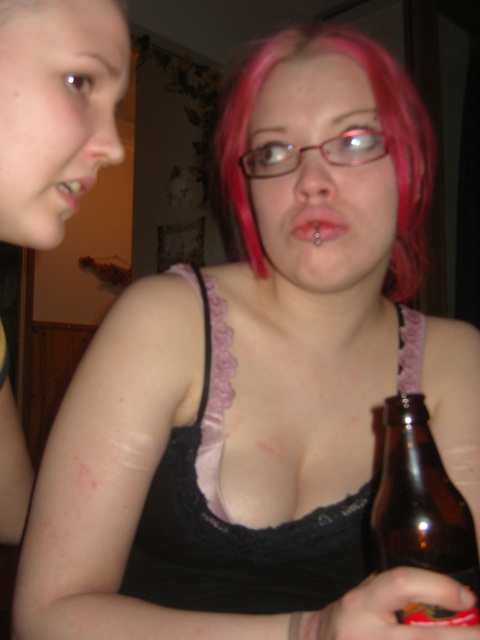
Question: Estimate the real-world distances between objects in this image. Which object is farther from the pink hair at center?

Choices:
 (A) brown glass bottle at lower right
 (B) matte pink lips at center
 (C) matte flesh-colored lips at center

Answer: (C)

Question: Which object is positioned farthest from the matte pink lips at center?

Choices:
 (A) pink hair at center
 (B) brown glass bottle at lower right
 (C) matte flesh-colored lips at center

Answer: (A)

Question: Does pink hair at center have a larger size compared to matte pink lips at center?

Choices:
 (A) no
 (B) yes

Answer: (B)

Question: Is pink hair at center thinner than matte pink lips at center?

Choices:
 (A) no
 (B) yes

Answer: (A)

Question: Does pink hair at center lie in front of matte flesh-colored lips at center?

Choices:
 (A) yes
 (B) no

Answer: (B)

Question: Which of the following is the closest to the observer?

Choices:
 (A) matte flesh-colored lips at center
 (B) pink hair at center
 (C) matte pink lips at center
 (D) brown glass bottle at lower right

Answer: (D)